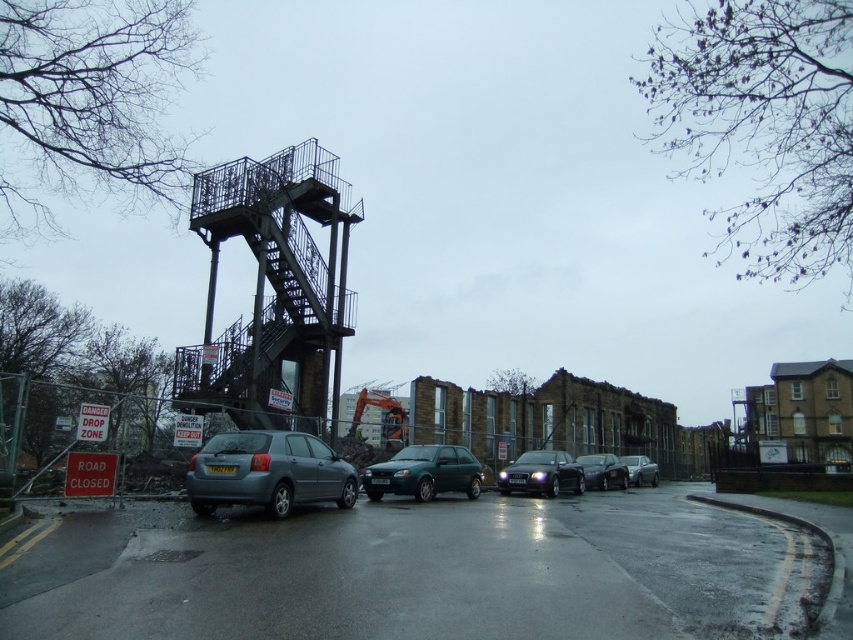
Question: In this image, where is shiny black sedan at center located relative to metallic silver car at center?

Choices:
 (A) left
 (B) right

Answer: (A)

Question: Which object appears farthest from the camera in this image?

Choices:
 (A) matte gray hatchback at center
 (B) shiny silver sedan at center
 (C) metallic silver car at center

Answer: (C)

Question: Among these points, which one is nearest to the camera?

Choices:
 (A) (563, 486)
 (B) (589, 484)
 (C) (428, 452)
 (D) (640, 472)

Answer: (C)

Question: Does shiny black sedan at center lie in front of metallic silver car at center?

Choices:
 (A) no
 (B) yes

Answer: (B)

Question: Is matte gray hatchback at center smaller than green matte hatchback at center?

Choices:
 (A) no
 (B) yes

Answer: (A)

Question: Estimate the real-world distances between objects in this image. Which object is closer to the shiny silver sedan at center?

Choices:
 (A) green matte hatchback at center
 (B) matte gray hatchback at center
 (C) shiny black sedan at center
 (D) metallic silver car at center

Answer: (C)